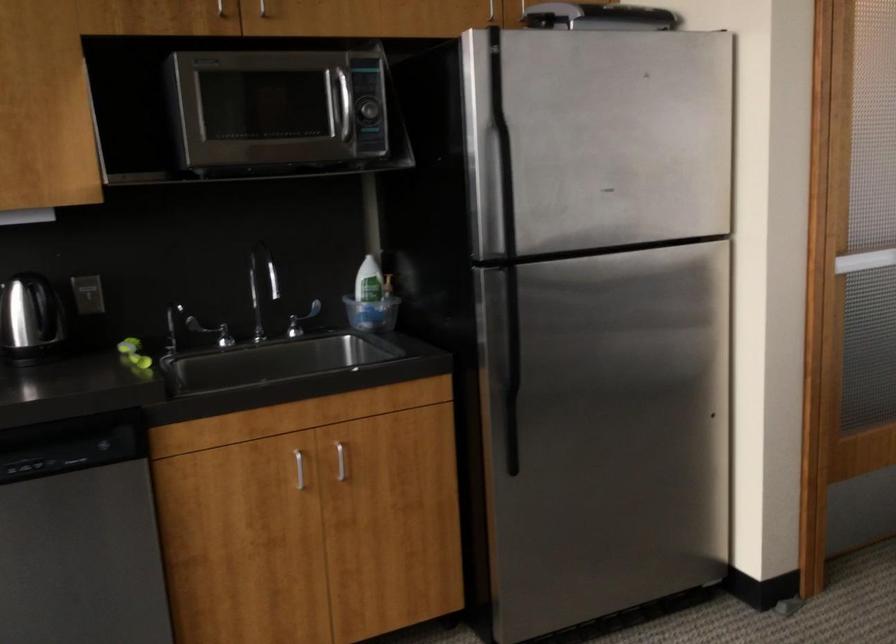
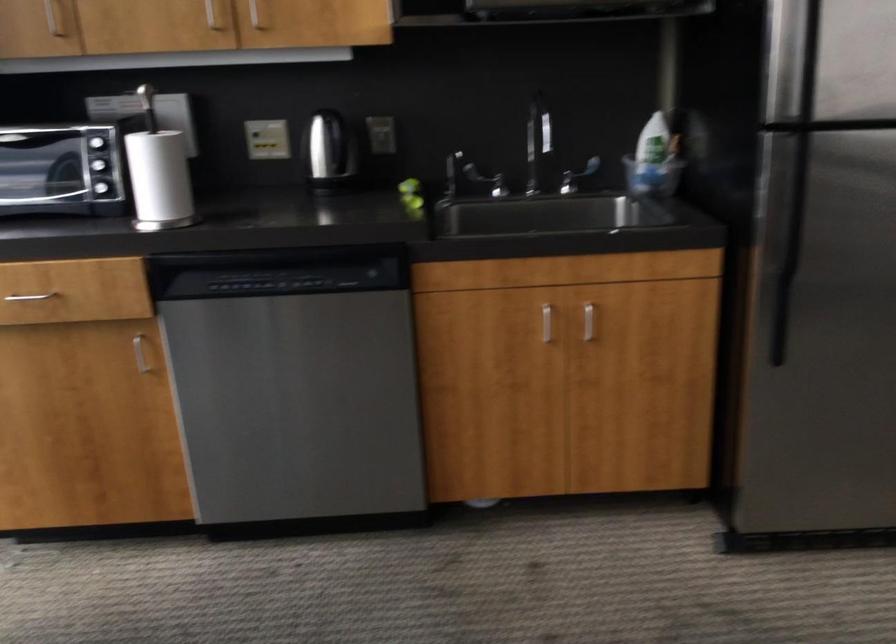
In the second image, find the point that corresponds to point (296, 321) in the first image.

(576, 176)